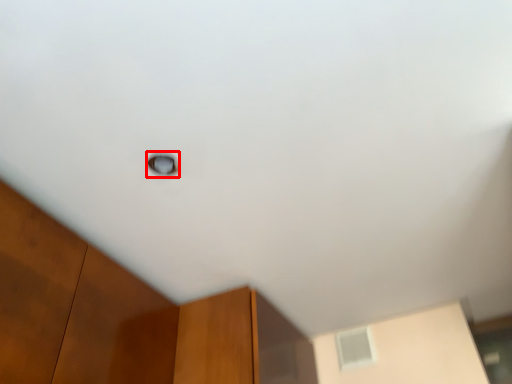
Question: From the image's perspective, considering the relative positions of window (annotated by the red box) and window in the image provided, where is window (annotated by the red box) located with respect to the staircase?

Choices:
 (A) above
 (B) below

Answer: (A)